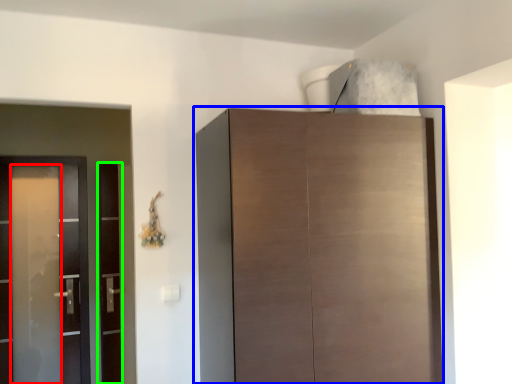
Question: Which object is positioned farthest from screen door (highlighted by a red box)? Select from cupboard (highlighted by a blue box) and screen door (highlighted by a green box).

Choices:
 (A) cupboard
 (B) screen door

Answer: (A)